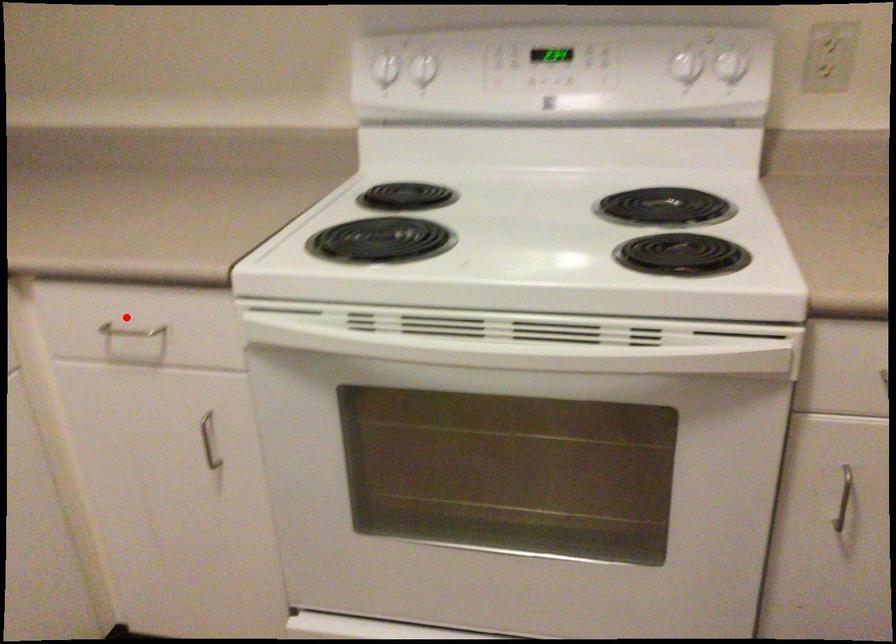
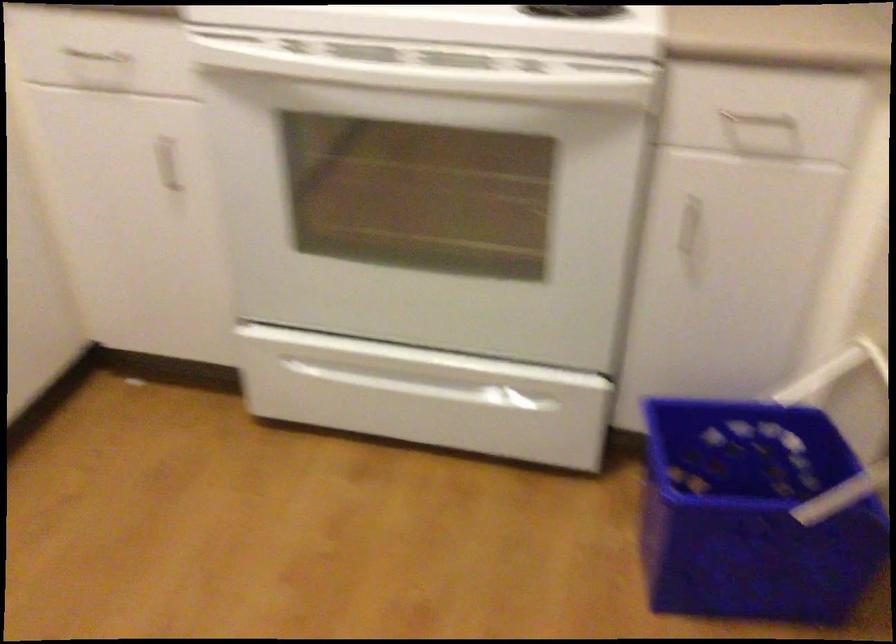
Where in the second image is the point corresponding to the highlighted location from the first image?

(97, 57)